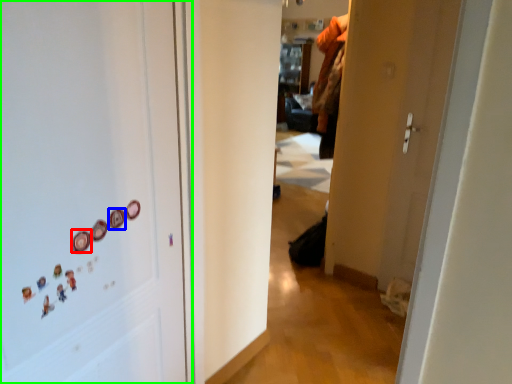
Question: Which object is positioned farthest from button (highlighted by a red box)? Select from button (highlighted by a blue box) and door (highlighted by a green box).

Choices:
 (A) button
 (B) door

Answer: (B)